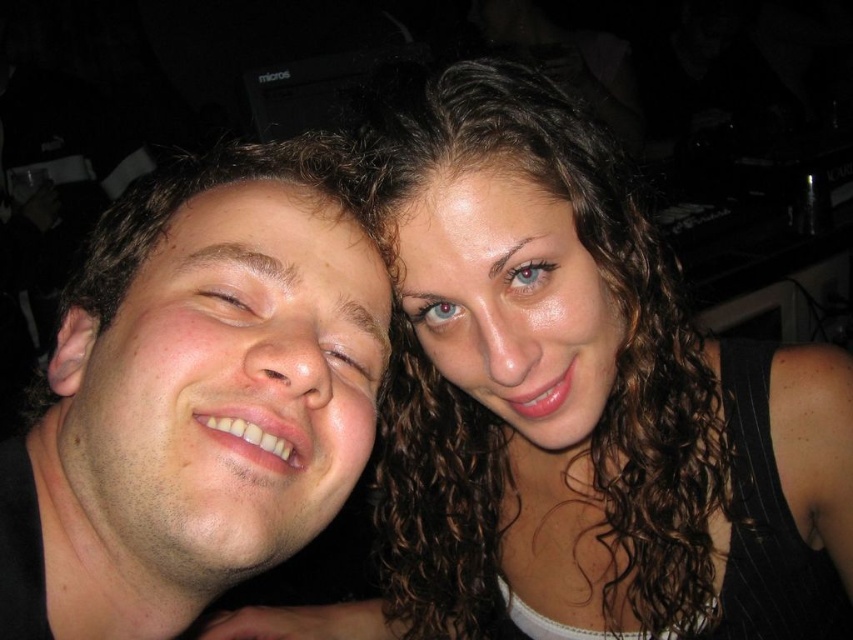
Question: Which point appears closest to the camera in this image?

Choices:
 (A) (107, 476)
 (B) (547, 275)

Answer: (A)

Question: In this image, where is curly hair at center located relative to matte skin face at center?

Choices:
 (A) right
 (B) left

Answer: (A)

Question: Can you confirm if matte skin face at center is thinner than shiny brown hair at center?

Choices:
 (A) yes
 (B) no

Answer: (B)

Question: Among these objects, which one is nearest to the camera?

Choices:
 (A) matte skin face at center
 (B) curly hair at center
 (C) shiny brown hair at center

Answer: (A)

Question: Which of these objects is positioned farthest from the matte skin face at center?

Choices:
 (A) shiny brown hair at center
 (B) curly hair at center

Answer: (B)

Question: Considering the relative positions of matte skin face at center and shiny brown hair at center in the image provided, where is matte skin face at center located with respect to shiny brown hair at center?

Choices:
 (A) right
 (B) left

Answer: (B)